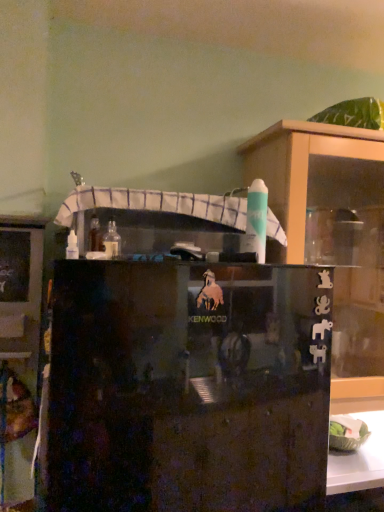
How much space does matte black cabinet at left, the 2th cabinetry when ordered from right to left, occupy horizontally?

matte black cabinet at left, the 2th cabinetry when ordered from right to left, is 2.38 inches wide.

What do you see at coordinates (188, 387) in the screenshot?
I see `black glossy cabinet at center, the 1th cabinetry positioned from the right` at bounding box center [188, 387].

This screenshot has width=384, height=512. In order to click on black glossy cabinet at center, which is the 2th cabinetry from left to right in this screenshot , I will do `click(188, 387)`.

The height and width of the screenshot is (512, 384). Find the location of `white fabric at upper center`. white fabric at upper center is located at coordinates (156, 204).

Consider the image. Does clear glass bottle at center have a greater height compared to white fabric at upper center?

No, clear glass bottle at center is not taller than white fabric at upper center.

In terms of width, does clear glass bottle at center look wider or thinner when compared to white fabric at upper center?

Considering their sizes, clear glass bottle at center looks slimmer than white fabric at upper center.

From the image's perspective, is clear glass bottle at center positioned above or below white fabric at upper center?

clear glass bottle at center is below white fabric at upper center.

Can you tell me how much matte black cabinet at left, the 1th cabinetry viewed from the left, and black glossy cabinet at center, the 1th cabinetry positioned from the right, differ in facing direction?

They differ by 0.0879 degrees in their facing directions.

Which of these two, matte black cabinet at left, the 1th cabinetry viewed from the left, or black glossy cabinet at center, which is the 2th cabinetry from left to right, stands taller?

black glossy cabinet at center, which is the 2th cabinetry from left to right, is taller.

Which is closer to the camera, (42, 249) or (90, 462)?

Clearly, point (42, 249) is more distant from the camera than point (90, 462).

Is matte black cabinet at left, the 1th cabinetry viewed from the left, thinner than black glossy cabinet at center, the 1th cabinetry positioned from the right?

Indeed, matte black cabinet at left, the 1th cabinetry viewed from the left, has a lesser width compared to black glossy cabinet at center, the 1th cabinetry positioned from the right.

Is white fabric at upper center turned away from transparent glass cupboard at upper right?

That's not correct — white fabric at upper center is not looking away from transparent glass cupboard at upper right.

Does point (110, 200) appear closer or farther from the camera than point (304, 242)?

Point (110, 200) appears to be closer to the viewer than point (304, 242).

Considering the relative positions of white fabric at upper center and transparent glass cupboard at upper right in the image provided, is white fabric at upper center to the left of transparent glass cupboard at upper right from the viewer's perspective?

Yes, white fabric at upper center is to the left of transparent glass cupboard at upper right.

What's the angular difference between white fabric at upper center and transparent glass cupboard at upper right's facing directions?

There is a 0.000929-degree angle between the facing directions of white fabric at upper center and transparent glass cupboard at upper right.

From the image's perspective, is black glossy cabinet at center, which is the 2th cabinetry from left to right, located beneath clear glass bottle at center?

Correct, black glossy cabinet at center, which is the 2th cabinetry from left to right, appears lower than clear glass bottle at center in the image.

Does black glossy cabinet at center, the 1th cabinetry positioned from the right, have a smaller size compared to clear glass bottle at center?

Incorrect, black glossy cabinet at center, the 1th cabinetry positioned from the right, is not smaller in size than clear glass bottle at center.

From a real-world perspective, count 2nd cabinetrys downward from the clear glass bottle at center and point to it. Please provide its 2D coordinates.

[(188, 387)]

In the scene shown: Is black glossy cabinet at center, which is the 2th cabinetry from left to right, to the right of clear glass bottle at center from the viewer's perspective?

Correct, you'll find black glossy cabinet at center, which is the 2th cabinetry from left to right, to the right of clear glass bottle at center.

From a real-world perspective, is clear glass bottle at center positioned over transparent glass cupboard at upper right based on gravity?

Yes.

Which is nearer, (111, 254) or (341, 402)?

Point (111, 254)

Is clear glass bottle at center far away from transparent glass cupboard at upper right?

No, clear glass bottle at center is in close proximity to transparent glass cupboard at upper right.

Find the location of a particular element. cupboard below the clear glass bottle at center (from the image's perspective) is located at coordinates (333, 236).

From the image's perspective, between black glossy cabinet at center, the 1th cabinetry positioned from the right, and white fabric at upper center, who is located below?

black glossy cabinet at center, the 1th cabinetry positioned from the right, is shown below in the image.

Considering the positions of point (78, 368) and point (76, 208), is point (78, 368) closer or farther from the camera than point (76, 208)?

Point (78, 368) appears to be closer to the viewer than point (76, 208).

Does black glossy cabinet at center, which is the 2th cabinetry from left to right, have a smaller size compared to white fabric at upper center?

Actually, black glossy cabinet at center, which is the 2th cabinetry from left to right, might be larger than white fabric at upper center.

Can you confirm if black glossy cabinet at center, the 1th cabinetry positioned from the right, is taller than white fabric at upper center?

→ Correct, black glossy cabinet at center, the 1th cabinetry positioned from the right, is much taller as white fabric at upper center.

Would you consider white fabric at upper center to be distant from matte black cabinet at left, the 2th cabinetry when ordered from right to left?

That's not correct — white fabric at upper center is a little close to matte black cabinet at left, the 2th cabinetry when ordered from right to left.

From a real-world perspective, is white fabric at upper center beneath matte black cabinet at left, the 2th cabinetry when ordered from right to left?

No, from a real-world perspective, white fabric at upper center is not under matte black cabinet at left, the 2th cabinetry when ordered from right to left.

Is white fabric at upper center looking in the opposite direction of matte black cabinet at left, the 2th cabinetry when ordered from right to left?

No.

The height and width of the screenshot is (512, 384). I want to click on cabinetry that is the 1st one when counting downward from the white fabric at upper center (from the image's perspective), so tap(19, 353).

The width and height of the screenshot is (384, 512). Identify the location of shelf behind the clear glass bottle at center. (156, 204).

At what (x,y) coordinates should I click in order to perform the action: click on cabinetry that is in front of the matte black cabinet at left, the 1th cabinetry viewed from the left. Please return your answer as a coordinate pair (x, y). The image size is (384, 512). Looking at the image, I should click on (188, 387).

When comparing their distances from black glossy cabinet at center, which is the 2th cabinetry from left to right, does transparent glass cupboard at upper right or clear glass bottle at center seem closer?

clear glass bottle at center is positioned closer to the anchor black glossy cabinet at center, which is the 2th cabinetry from left to right.

Considering their positions, is black glossy cabinet at center, which is the 2th cabinetry from left to right, positioned closer to transparent glass cupboard at upper right than clear glass bottle at center?

black glossy cabinet at center, which is the 2th cabinetry from left to right.

When comparing their distances from white fabric at upper center, does black glossy cabinet at center, the 1th cabinetry positioned from the right, or matte black cabinet at left, the 1th cabinetry viewed from the left, seem further?

Based on the image, black glossy cabinet at center, the 1th cabinetry positioned from the right, appears to be further to white fabric at upper center.

Looking at the image, which one is located further to transparent glass cupboard at upper right, black glossy cabinet at center, which is the 2th cabinetry from left to right, or white fabric at upper center?

Among the two, black glossy cabinet at center, which is the 2th cabinetry from left to right, is located further to transparent glass cupboard at upper right.

Based on their spatial positions, is transparent glass cupboard at upper right or white fabric at upper center further from black glossy cabinet at center, the 1th cabinetry positioned from the right?

transparent glass cupboard at upper right.

Based on their spatial positions, is transparent glass cupboard at upper right or clear glass bottle at center closer to white fabric at upper center?

clear glass bottle at center.

Looking at the image, which one is located closer to clear glass bottle at center, black glossy cabinet at center, the 1th cabinetry positioned from the right, or transparent glass cupboard at upper right?

Among the two, black glossy cabinet at center, the 1th cabinetry positioned from the right, is located nearer to clear glass bottle at center.

Estimate the real-world distances between objects in this image. Which object is further from white fabric at upper center, clear glass bottle at center or black glossy cabinet at center, the 1th cabinetry positioned from the right?

The object further to white fabric at upper center is black glossy cabinet at center, the 1th cabinetry positioned from the right.

Locate an element on the screen. Image resolution: width=384 pixels, height=512 pixels. bottle between white fabric at upper center and black glossy cabinet at center, the 1th cabinetry positioned from the right, from top to bottom is located at coordinates (112, 240).

This screenshot has height=512, width=384. Identify the location of cabinetry located between clear glass bottle at center and transparent glass cupboard at upper right in the left-right direction. (188, 387).

This screenshot has height=512, width=384. Identify the location of shelf between clear glass bottle at center and transparent glass cupboard at upper right. (156, 204).

You are a GUI agent. You are given a task and a screenshot of the screen. Output one action in this format:
    pyautogui.click(x=<x>, y=<y>)
    Task: Click on the cabinetry between clear glass bottle at center and black glossy cabinet at center, the 1th cabinetry positioned from the right, from top to bottom
    
    Given the screenshot: What is the action you would take?
    pyautogui.click(x=19, y=353)